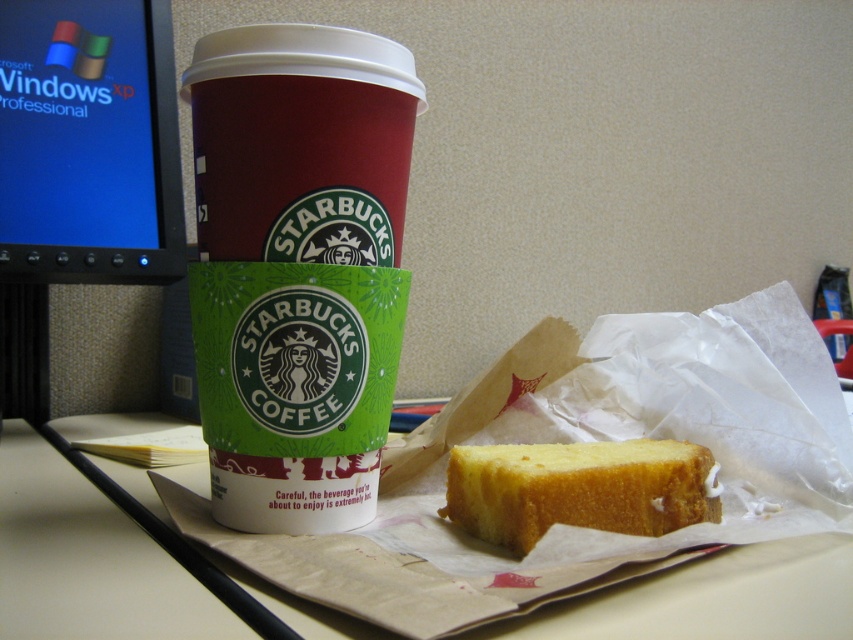
Who is higher up, white paper at center or yellow sponge cake at center?

yellow sponge cake at center

At what (x,y) coordinates should I click in order to perform the action: click on white paper at center. Please return your answer as a coordinate pair (x, y). Image resolution: width=853 pixels, height=640 pixels. Looking at the image, I should click on click(x=86, y=560).

Measure the distance between matte black monitor at left and camera.

matte black monitor at left is 32.47 inches from camera.

Between point (151, 58) and point (648, 492), which one is positioned in front?

Point (648, 492) is more forward.

From the picture: Who is more distant from viewer, [123,228] or [492,508]?

Positioned behind is point [123,228].

This screenshot has height=640, width=853. What are the coordinates of `matte black monitor at left` in the screenshot? It's located at (88, 144).

Which is more to the right, white paper at center or matte black monitor at left?

white paper at center is more to the right.

Between white paper at center and matte black monitor at left, which one has less height?

Answer: With less height is white paper at center.

Is point (57, 602) closer to camera compared to point (158, 106)?

Yes, it is in front of point (158, 106).

Find the location of `white paper at center`. white paper at center is located at coordinates (86, 560).